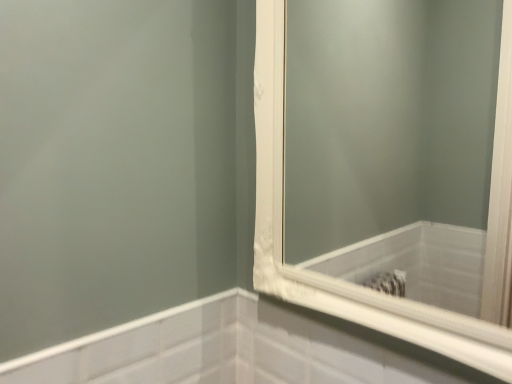
What are the coordinates of `white glossy mirror at upper right` in the screenshot? It's located at (387, 117).

The height and width of the screenshot is (384, 512). Describe the element at coordinates (387, 117) in the screenshot. I see `white glossy mirror at upper right` at that location.

At what (x,y) coordinates should I click in order to perform the action: click on white glossy mirror at upper right. Please return your answer as a coordinate pair (x, y). The width and height of the screenshot is (512, 384). Looking at the image, I should click on (387, 117).